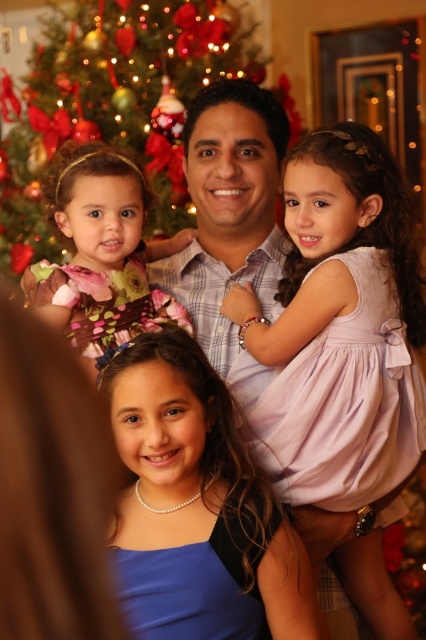
In the festive family photo, there are a man wearing a plaid shirt at center and a girl in a pink satin dress at center. Which clothing item is wider?

The pink satin dress at center is wider than the plaid shirt at center.